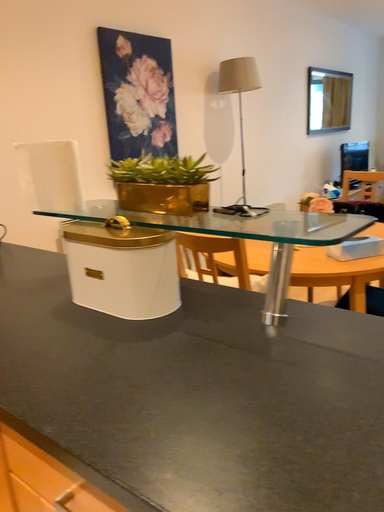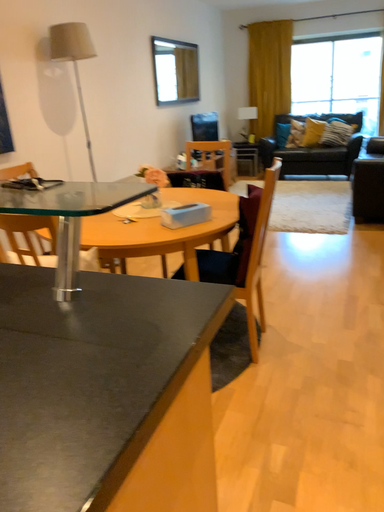
Question: Which way did the camera rotate in the video?

Choices:
 (A) rotated left
 (B) rotated right

Answer: (B)